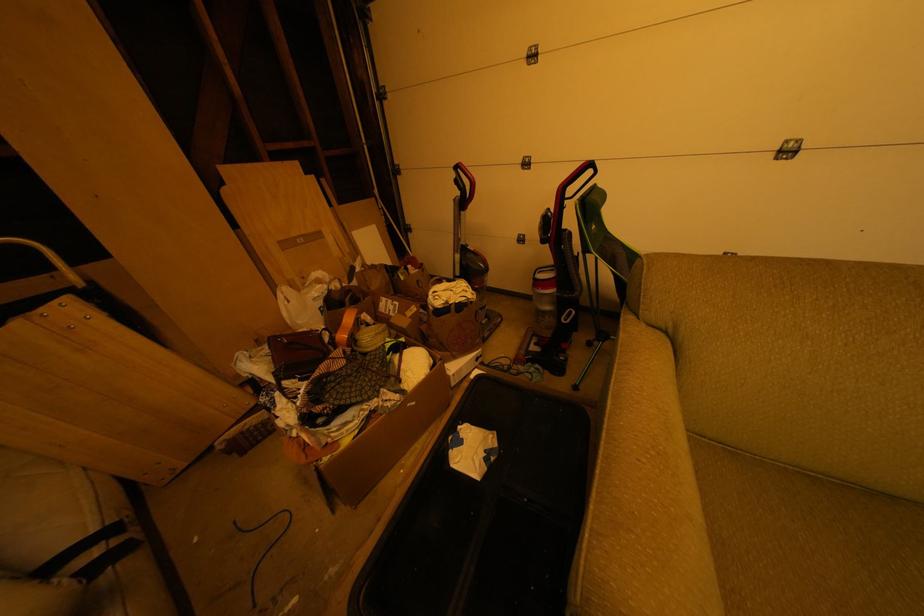
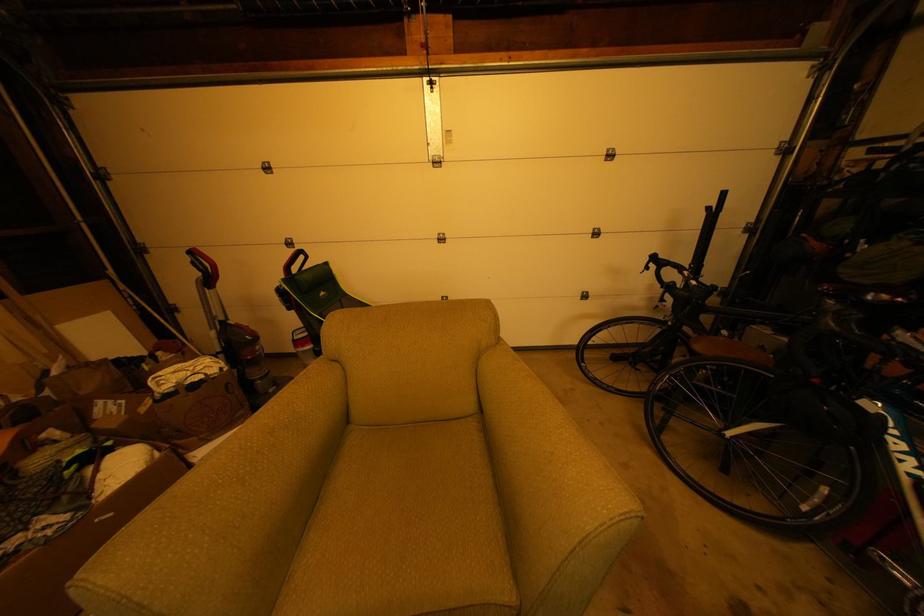
Question: The camera is either moving clockwise (left) or counter-clockwise (right) around the object. The first image is from the beginning of the video and the second image is from the end. Is the camera moving left or right when shooting the video?

Choices:
 (A) Left
 (B) Right

Answer: (A)